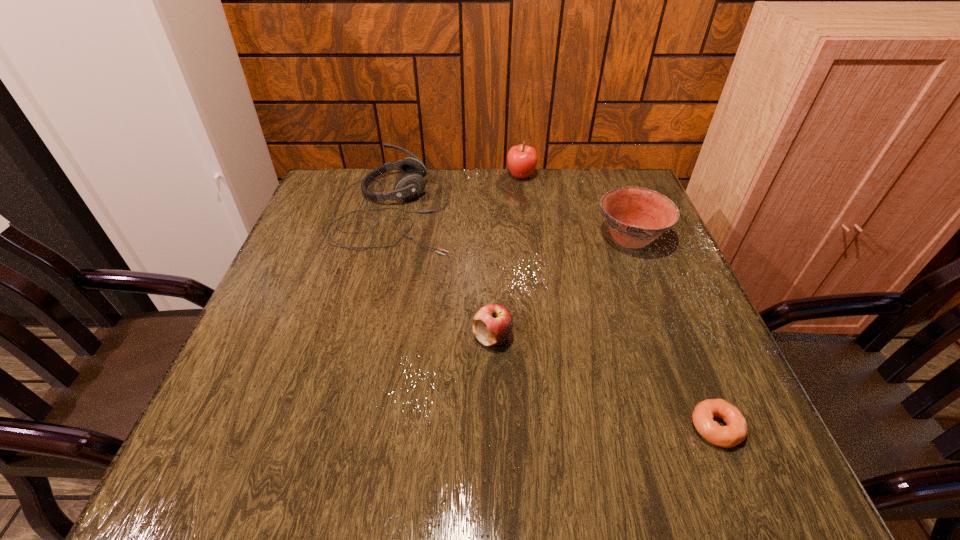
Identify the location of the taller apple. The height and width of the screenshot is (540, 960). (521, 159).

Where is `the third object from right to left`? The width and height of the screenshot is (960, 540). the third object from right to left is located at coordinates (521, 159).

In order to click on headset in this screenshot , I will do `click(410, 185)`.

Where is `bowl`? Image resolution: width=960 pixels, height=540 pixels. bowl is located at coordinates (636, 216).

I want to click on the shorter apple, so click(x=492, y=324).

In order to click on the second object from left to right in this screenshot , I will do `click(492, 324)`.

The height and width of the screenshot is (540, 960). What are the coordinates of `the nearest object` in the screenshot? It's located at (736, 429).

The height and width of the screenshot is (540, 960). I want to click on the shortest object, so click(736, 429).

Where is `vacant region located on the front of the farther apple`? The height and width of the screenshot is (540, 960). vacant region located on the front of the farther apple is located at coordinates (529, 237).

You are a GUI agent. You are given a task and a screenshot of the screen. Output one action in this format:
    pyautogui.click(x=<x>, y=<y>)
    Task: Click on the free space located 0.290m on the outer surface of the leftmost object
    The width and height of the screenshot is (960, 540).
    Given the screenshot: What is the action you would take?
    pyautogui.click(x=562, y=209)